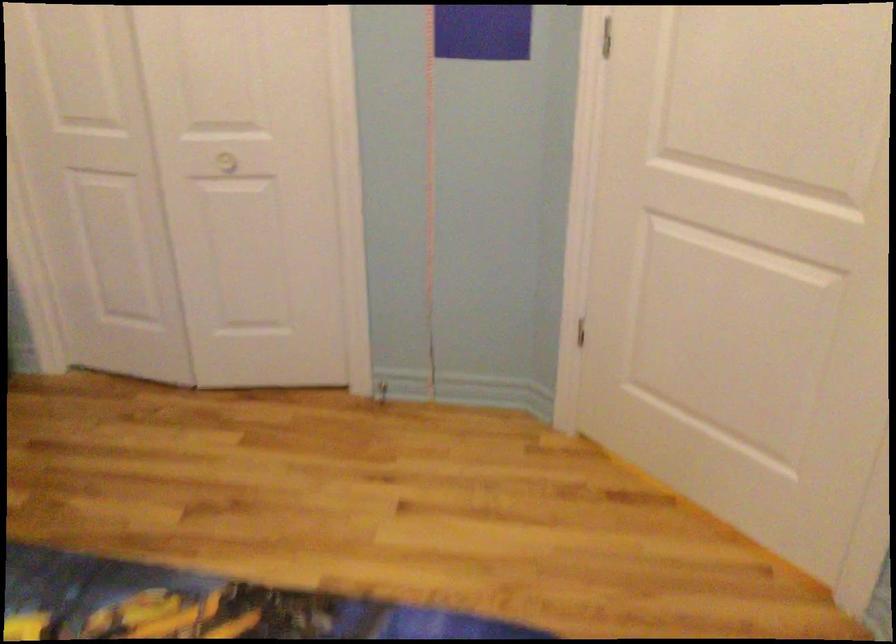
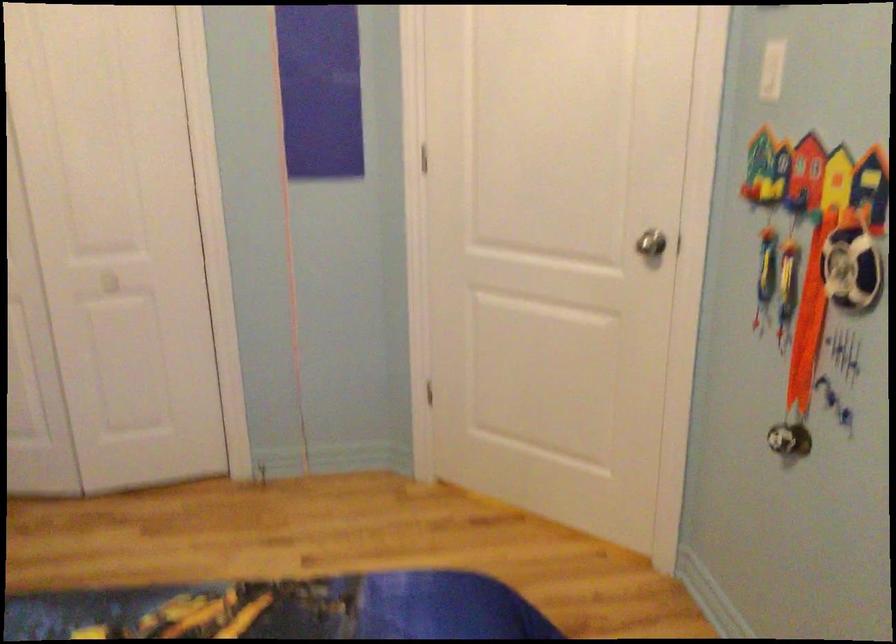
What movement of the cameraman would produce the second image?

The movement direction of the cameraman is left, backward.